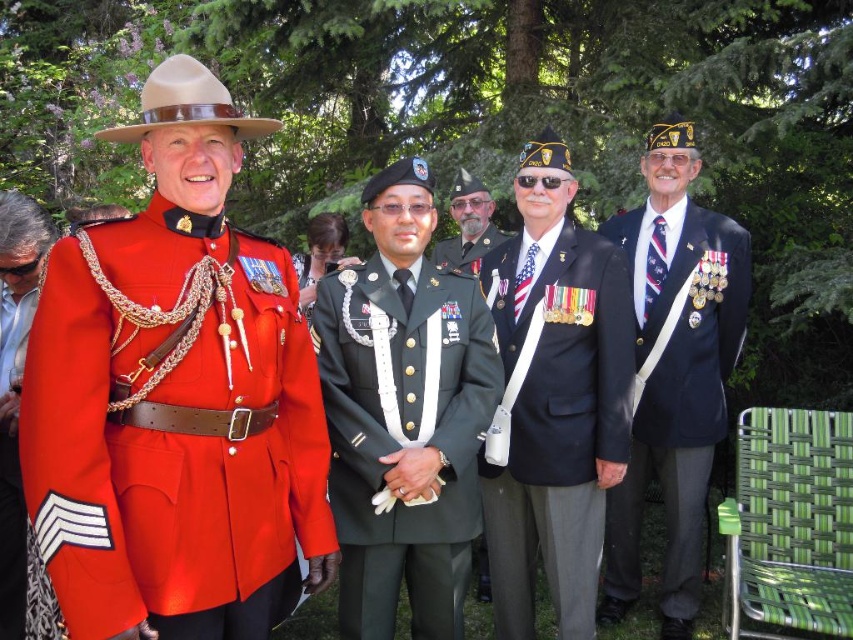
At what (x,y) coordinates should I click in order to perform the action: click on navy blue wool suit at center. Please return your answer as a coordinate pair (x, y). Looking at the image, I should click on (554, 419).

Can you confirm if navy blue wool suit at center is positioned to the right of beige felt cowboy hat at upper left?

Yes, navy blue wool suit at center is to the right of beige felt cowboy hat at upper left.

Locate an element on the screen. navy blue wool suit at center is located at coordinates (554, 419).

Does point (0, 392) come closer to viewer compared to point (259, 129)?

No.

How much distance is there between shiny red fabric at left and beige felt cowboy hat at upper left?

shiny red fabric at left is 1.40 meters from beige felt cowboy hat at upper left.

Is point (9, 380) closer to viewer compared to point (225, 100)?

No, (9, 380) is behind (225, 100).

Where is `shiny red fabric at left`? shiny red fabric at left is located at coordinates (10, 532).

Who is more forward, (138, 273) or (453, 260)?

Point (138, 273)

Is shiny red fabric uniform at left thinner than green fabric uniform at center?

No.

Which is in front, point (247, 566) or point (482, 244)?

Positioned in front is point (247, 566).

The width and height of the screenshot is (853, 640). What are the coordinates of `shiny red fabric uniform at left` in the screenshot? It's located at (172, 428).